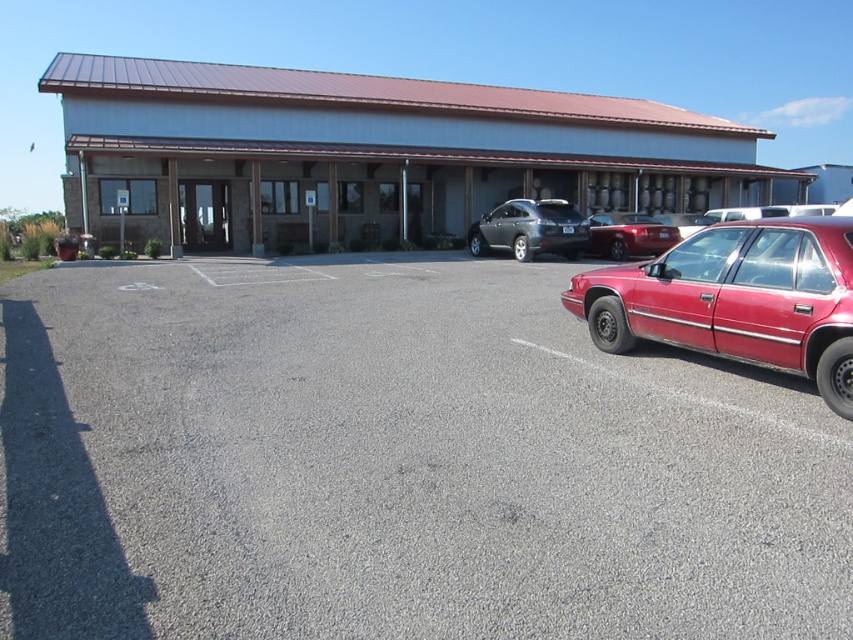
You are standing in front of the commercial building and want to determine the relative positions of two points marked on the parking lot. Which point is closer to you, point (466, 392) or point (480, 252)?

Point (466, 392) is closer to the viewer than point (480, 252).

You are standing at the entrance of the commercial building and want to park your car. The parking lot has a marked parking space at point (396, 464). Is this parking space located on the gray asphalt parking lot at lower right?

Yes, the point (396, 464) is on the gray asphalt parking lot at lower right, so the parking space is located there.

You are a delivery driver who needs to park your 6.5 feet tall truck in the parking lot. The glossy red sedan at right and the satin black sedan at center are already parked there. Which vehicle should you avoid parking next to to ensure your truck doesn

The glossy red sedan at right is much taller than the satin black sedan at center. Since your truck is 6.5 feet tall, you should avoid parking next to the taller vehicle, which is the glossy red sedan at right, to prevent any potential height clearance issues.